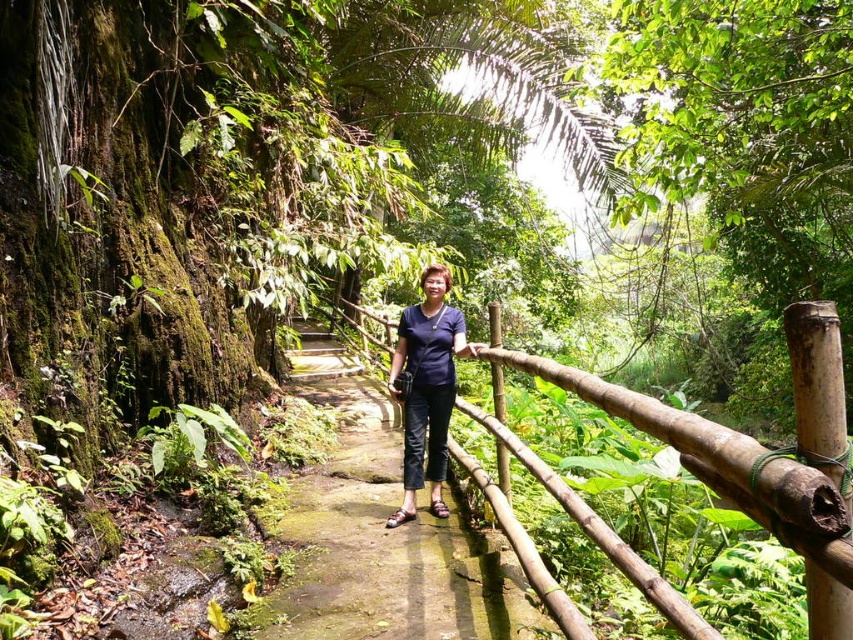
Question: In this image, where is brown bamboo rail at center located relative to blue fabric shirt at center?

Choices:
 (A) right
 (B) left

Answer: (A)

Question: Does green mossy stone path at center have a smaller size compared to blue fabric shirt at center?

Choices:
 (A) no
 (B) yes

Answer: (B)

Question: Is brown bamboo rail at center further to camera compared to blue fabric shirt at center?

Choices:
 (A) yes
 (B) no

Answer: (B)

Question: Estimate the real-world distances between objects in this image. Which object is farther from the brown bamboo rail at center?

Choices:
 (A) green mossy stone path at center
 (B) blue fabric shirt at center

Answer: (A)

Question: Which point is farther to the camera?

Choices:
 (A) brown bamboo rail at center
 (B) green mossy stone path at center

Answer: (B)

Question: Among these points, which one is farthest from the camera?

Choices:
 (A) click(x=792, y=483)
 (B) click(x=300, y=579)

Answer: (B)